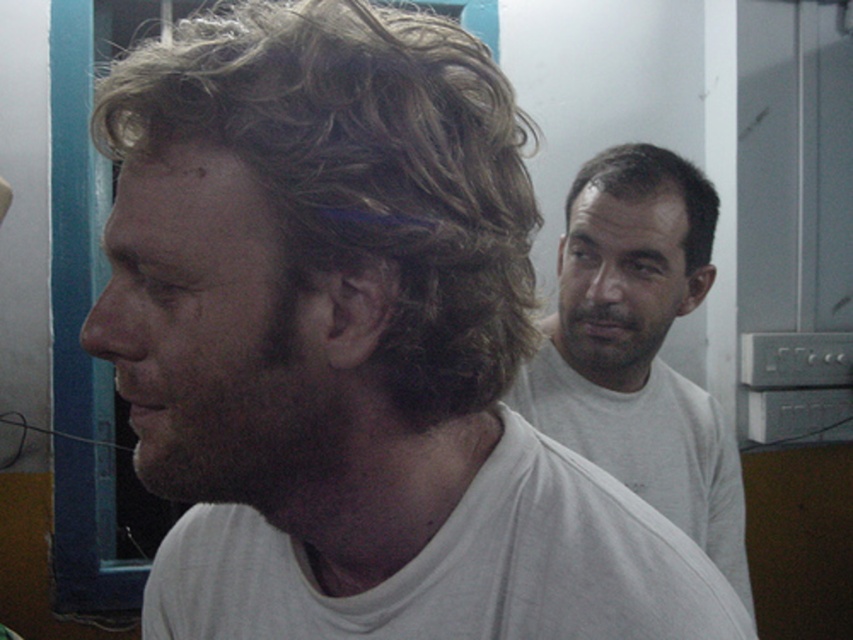
Question: Considering the relative positions of brown curly hair at left and dark brown fuzzy beard at left in the image provided, where is brown curly hair at left located with respect to dark brown fuzzy beard at left?

Choices:
 (A) below
 (B) above

Answer: (B)

Question: Which point appears closest to the camera in this image?

Choices:
 (A) (206, 545)
 (B) (672, 280)
 (C) (614, 147)
 (D) (294, 305)

Answer: (D)

Question: Which point is closer to the camera taking this photo?

Choices:
 (A) (160, 396)
 (B) (624, 339)
 (C) (695, 204)
 (D) (207, 508)

Answer: (A)

Question: Among these points, which one is nearest to the camera?

Choices:
 (A) (695, 195)
 (B) (682, 440)
 (C) (202, 97)
 (D) (247, 428)

Answer: (C)

Question: Can you confirm if brown curly hair at left is positioned above dark brown fuzzy beard at left?

Choices:
 (A) yes
 (B) no

Answer: (A)

Question: Is brown curly hair at left further to camera compared to white cotton t-shirt at center?

Choices:
 (A) yes
 (B) no

Answer: (B)